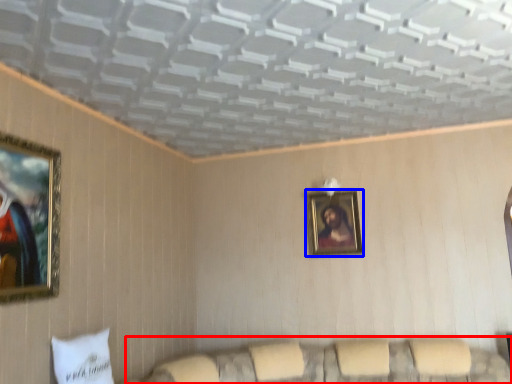
Question: Among these objects, which one is farthest to the camera, couch (highlighted by a red box) or picture frame (highlighted by a blue box)?

Choices:
 (A) couch
 (B) picture frame

Answer: (B)